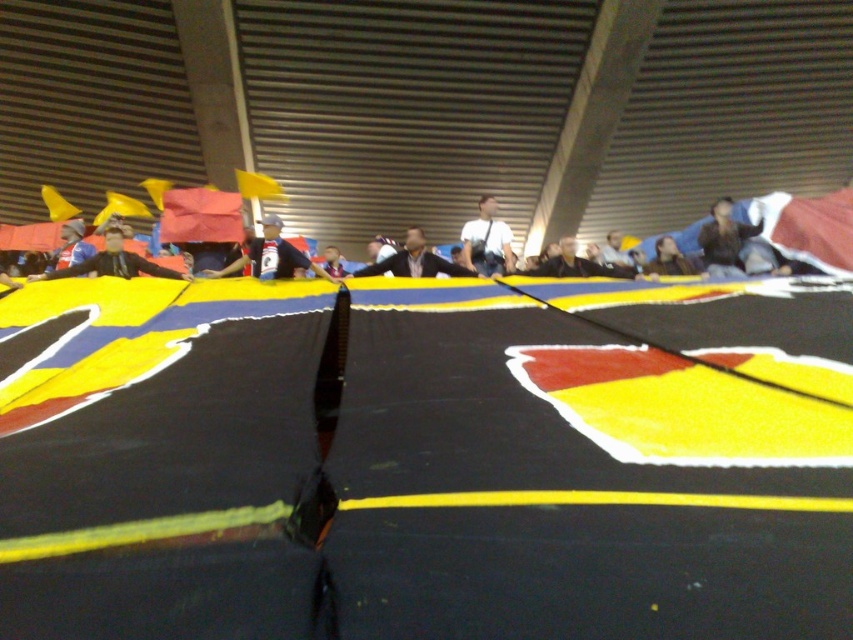
You are a photographer at the event and want to capture both the yellow matte flag at center and the dark blue fabric at upper center in a single shot. Which object should you focus on first to ensure both are in frame?

The yellow matte flag at center is smaller than the dark blue fabric at upper center, so you should focus on the dark blue fabric at upper center first to ensure both are in frame.

You are an event organizer who needs to ensure that all items displayed in the foreground are visible to the crowd. Given that the red fabric flag at upper right and the dark brown leather jacket at center are both in the foreground, which item would likely block the view of the other if placed closer to the front?

The red fabric flag at upper right has a larger width than the dark brown leather jacket at center, so if placed closer to the front, it would likely block the view of the dark brown leather jacket at center due to its greater width.

In the scene shown: You are a photographer at the event and want to capture both the red fabric flag at upper right and the dark brown leather jacket at center in the same frame. Which object should you adjust your camera to focus on first to ensure both are in the shot?

The red fabric flag at upper right is positioned on the right side of dark brown leather jacket at center, so you should focus on the dark brown leather jacket at center first to ensure both are in the shot.